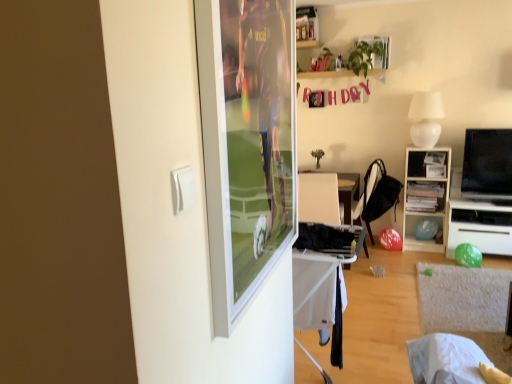
Question: Could white matte lampshade at upper right be considered to be inside black fabric laundry at center?

Choices:
 (A) no
 (B) yes

Answer: (A)

Question: Could you tell me if black fabric laundry at center is turned towards white matte lampshade at upper right?

Choices:
 (A) yes
 (B) no

Answer: (B)

Question: Is black fabric laundry at center smaller than white matte lampshade at upper right?

Choices:
 (A) yes
 (B) no

Answer: (A)

Question: Considering the relative sizes of black fabric laundry at center and white matte lampshade at upper right in the image provided, is black fabric laundry at center thinner than white matte lampshade at upper right?

Choices:
 (A) no
 (B) yes

Answer: (A)

Question: From a real-world perspective, is black fabric laundry at center physically above white matte lampshade at upper right?

Choices:
 (A) no
 (B) yes

Answer: (A)

Question: Is black fabric laundry at center positioned with its back to white matte lampshade at upper right?

Choices:
 (A) yes
 (B) no

Answer: (B)

Question: Is wooden bookshelf at right at the back of black fabric chair at center?

Choices:
 (A) no
 (B) yes

Answer: (A)

Question: Can you confirm if black fabric chair at center is wider than wooden bookshelf at right?

Choices:
 (A) no
 (B) yes

Answer: (B)

Question: Can you confirm if black fabric chair at center is shorter than wooden bookshelf at right?

Choices:
 (A) no
 (B) yes

Answer: (B)

Question: From the image's perspective, would you say black fabric chair at center is shown under wooden bookshelf at right?

Choices:
 (A) no
 (B) yes

Answer: (A)

Question: Considering the relative sizes of black fabric chair at center and wooden bookshelf at right in the image provided, is black fabric chair at center taller than wooden bookshelf at right?

Choices:
 (A) no
 (B) yes

Answer: (A)

Question: Is black fabric chair at center bigger than wooden bookshelf at right?

Choices:
 (A) yes
 (B) no

Answer: (B)

Question: Can you confirm if black fabric chair at center is thinner than black fabric laundry at center?

Choices:
 (A) no
 (B) yes

Answer: (B)